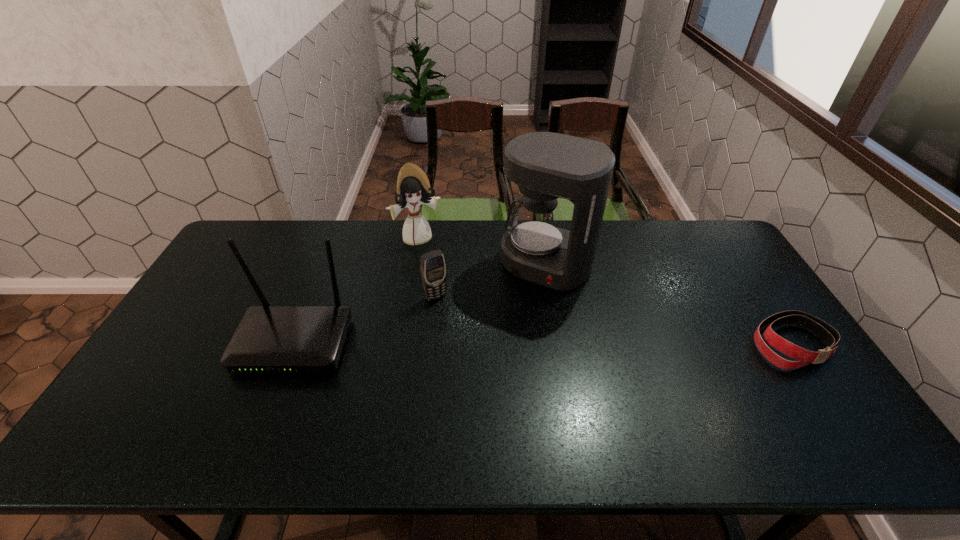
The height and width of the screenshot is (540, 960). What are the coordinates of `object present at the right edge` in the screenshot? It's located at (829, 335).

Locate an element on the screen. This screenshot has height=540, width=960. free space at the far edge of the desktop is located at coordinates (293, 249).

This screenshot has height=540, width=960. Identify the location of blank space at the near edge of the desktop. (236, 393).

Where is `free space at the left edge of the desktop`? The width and height of the screenshot is (960, 540). free space at the left edge of the desktop is located at coordinates (223, 282).

Locate an element on the screen. The height and width of the screenshot is (540, 960). vacant space at the right edge of the desktop is located at coordinates (749, 329).

Locate an element on the screen. The image size is (960, 540). free spot between the doll and the leftmost object is located at coordinates (356, 291).

Identify the location of free space between the doll and the leftmost object. The height and width of the screenshot is (540, 960). [x=356, y=291].

Locate an element on the screen. vacant region between the leftmost object and the fourth tallest object is located at coordinates point(365,320).

The height and width of the screenshot is (540, 960). In order to click on free space between the cellular telephone and the coffee maker in this screenshot , I will do `click(491, 281)`.

Identify the location of free point between the fourth object from left to right and the router. The image size is (960, 540). (420, 304).